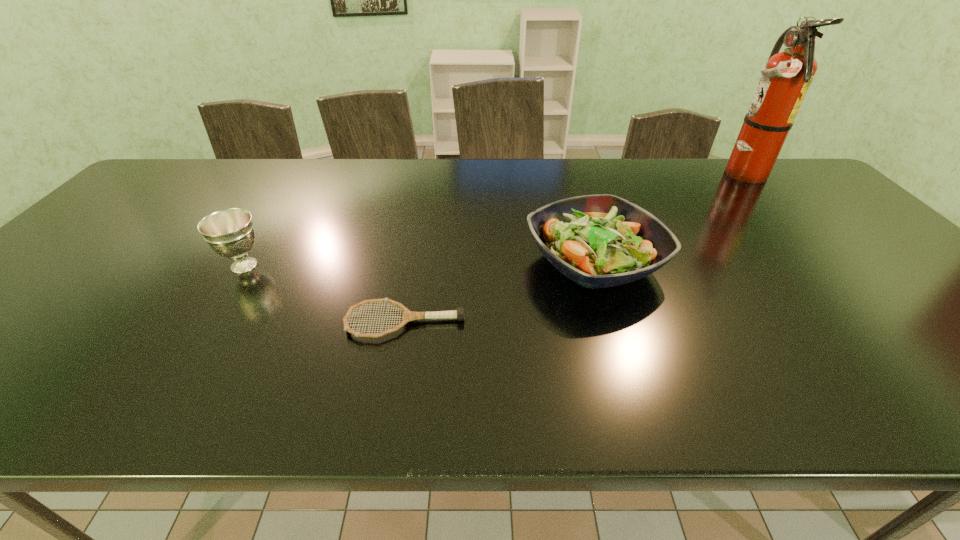
At what (x,y) coordinates should I click in order to perform the action: click on free space located on the front of the salad plate. Please return your answer as a coordinate pair (x, y). The image size is (960, 540). Looking at the image, I should click on (622, 352).

The height and width of the screenshot is (540, 960). Identify the location of vacant region located 0.110m on the front of the tennis racket. (394, 386).

The height and width of the screenshot is (540, 960). Identify the location of object that is at the far edge. (785, 80).

At what (x,y) coordinates should I click in order to perform the action: click on object that is positioned at the right edge. Please return your answer as a coordinate pair (x, y). The image size is (960, 540). Looking at the image, I should click on (785, 80).

Where is `object located at the far right corner`? Image resolution: width=960 pixels, height=540 pixels. object located at the far right corner is located at coordinates [785, 80].

Where is `vacant space at the far edge`? Image resolution: width=960 pixels, height=540 pixels. vacant space at the far edge is located at coordinates (687, 161).

At what (x,y) coordinates should I click in order to perform the action: click on free location at the left edge of the desktop. Please return your answer as a coordinate pair (x, y). This screenshot has height=540, width=960. Looking at the image, I should click on (60, 322).

At what (x,y) coordinates should I click in order to perform the action: click on vacant space at the right edge of the desktop. Please return your answer as a coordinate pair (x, y). The height and width of the screenshot is (540, 960). Looking at the image, I should click on (828, 231).

At what (x,y) coordinates should I click in order to perform the action: click on free space at the far right corner of the desktop. Please return your answer as a coordinate pair (x, y). Looking at the image, I should click on (813, 189).

This screenshot has width=960, height=540. Find the location of `empty space between the third object from right to left and the chalice`. empty space between the third object from right to left and the chalice is located at coordinates (324, 294).